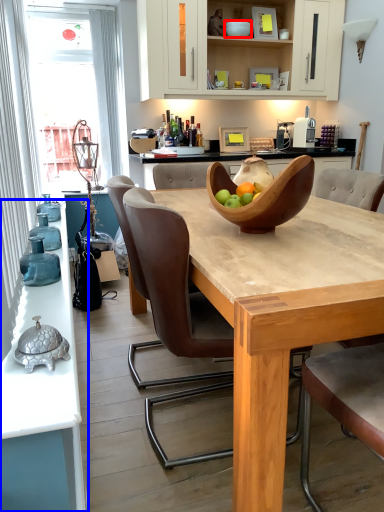
Question: Which object appears farthest to the camera in this image, bowl (highlighted by a red box) or countertop (highlighted by a blue box)?

Choices:
 (A) bowl
 (B) countertop

Answer: (A)